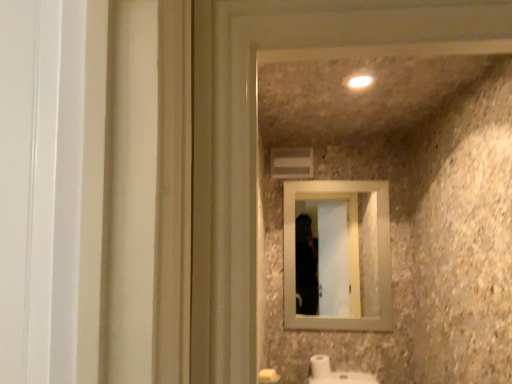
Image resolution: width=512 pixels, height=384 pixels. What do you see at coordinates (360, 81) in the screenshot? I see `white glossy light at upper center` at bounding box center [360, 81].

Describe the element at coordinates (345, 252) in the screenshot. I see `beige wood mirror at center` at that location.

At what (x,y) coordinates should I click in order to perform the action: click on white glossy light at upper center. Please return your answer as a coordinate pair (x, y). The height and width of the screenshot is (384, 512). Looking at the image, I should click on (360, 81).

From the picture: Which is closer, (333, 239) or (329, 369)?

Point (333, 239).

Could you tell me if beige wood mirror at center is turned towards white matte toilet paper at lower center?

No, beige wood mirror at center is not oriented towards white matte toilet paper at lower center.

Locate an element on the screen. mirror that appears on the right of white matte toilet paper at lower center is located at coordinates (345, 252).

From a real-world perspective, is beige wood mirror at center above or below white glossy light at upper center?

From a real-world perspective, beige wood mirror at center is physically below white glossy light at upper center.

From the image's perspective, which one is positioned lower, beige wood mirror at center or white glossy light at upper center?

From the image's view, beige wood mirror at center is below.

Is beige wood mirror at center oriented towards white glossy light at upper center?

Yes.

Which is in front, beige wood mirror at center or white glossy light at upper center?

Positioned in front is white glossy light at upper center.

From a real-world perspective, between white matte toilet paper at lower center and beige wood mirror at center, who is vertically higher?

beige wood mirror at center.

Which of these two, white matte toilet paper at lower center or beige wood mirror at center, is bigger?

Bigger between the two is beige wood mirror at center.

Is white matte toilet paper at lower center in contact with beige wood mirror at center?

They are not placed beside each other.

Is white matte toilet paper at lower center wider or thinner than beige wood mirror at center?

Clearly, white matte toilet paper at lower center has more width compared to beige wood mirror at center.

From a real-world perspective, is white glossy light at upper center above or below beige wood mirror at center?

Clearly, from a real-world perspective, white glossy light at upper center is above beige wood mirror at center.

From the image's perspective, is white glossy light at upper center beneath beige wood mirror at center?

No, from the image's perspective, white glossy light at upper center is not beneath beige wood mirror at center.

Which is nearer, (368, 81) or (349, 277)?

Clearly, point (368, 81) is closer to the camera than point (349, 277).

Based on the photo, is there a large distance between white glossy light at upper center and beige wood mirror at center?

Yes, white glossy light at upper center and beige wood mirror at center are located far from each other.

Locate an element on the screen. light to the right of white matte toilet paper at lower center is located at coordinates [360, 81].

From the image's perspective, is white glossy light at upper center under white matte toilet paper at lower center?

No.

Is white glossy light at upper center to the left of white matte toilet paper at lower center from the viewer's perspective?

Incorrect, white glossy light at upper center is not on the left side of white matte toilet paper at lower center.

Is point (366, 76) positioned after point (330, 369)?

No.

Which object is further away from the camera, white matte toilet paper at lower center or white glossy light at upper center?

white matte toilet paper at lower center.

In terms of height, does white matte toilet paper at lower center look taller or shorter compared to white glossy light at upper center?

Considering their sizes, white matte toilet paper at lower center has more height than white glossy light at upper center.

Does white matte toilet paper at lower center turn towards white glossy light at upper center?

No, white matte toilet paper at lower center is not facing towards white glossy light at upper center.

You are a GUI agent. You are given a task and a screenshot of the screen. Output one action in this format:
    pyautogui.click(x=<x>, y=<y>)
    Task: Click on the mirror on the right of white matte toilet paper at lower center
    Image resolution: width=512 pixels, height=384 pixels.
    Given the screenshot: What is the action you would take?
    pyautogui.click(x=345, y=252)

Image resolution: width=512 pixels, height=384 pixels. Identify the location of light above the beige wood mirror at center (from a real-world perspective). (360, 81).

From the image, which object appears to be farther from beige wood mirror at center, white matte toilet paper at lower center or white glossy light at upper center?

white glossy light at upper center is further to beige wood mirror at center.

Considering their positions, is white matte toilet paper at lower center positioned further to white glossy light at upper center than beige wood mirror at center?

beige wood mirror at center is positioned further to the anchor white glossy light at upper center.

Looking at the image, which one is located further to white matte toilet paper at lower center, white glossy light at upper center or beige wood mirror at center?

beige wood mirror at center is further to white matte toilet paper at lower center.

Considering their positions, is beige wood mirror at center positioned further to white matte toilet paper at lower center than white glossy light at upper center?

Among the two, beige wood mirror at center is located further to white matte toilet paper at lower center.

Looking at the image, which one is located closer to beige wood mirror at center, white glossy light at upper center or white matte toilet paper at lower center?

white matte toilet paper at lower center is closer to beige wood mirror at center.

Estimate the real-world distances between objects in this image. Which object is further from white glossy light at upper center, beige wood mirror at center or white matte toilet paper at lower center?

Among the two, beige wood mirror at center is located further to white glossy light at upper center.

You are a GUI agent. You are given a task and a screenshot of the screen. Output one action in this format:
    pyautogui.click(x=<x>, y=<y>)
    Task: Click on the mirror between white glossy light at upper center and white matte toilet paper at lower center from top to bottom
    
    Given the screenshot: What is the action you would take?
    pyautogui.click(x=345, y=252)